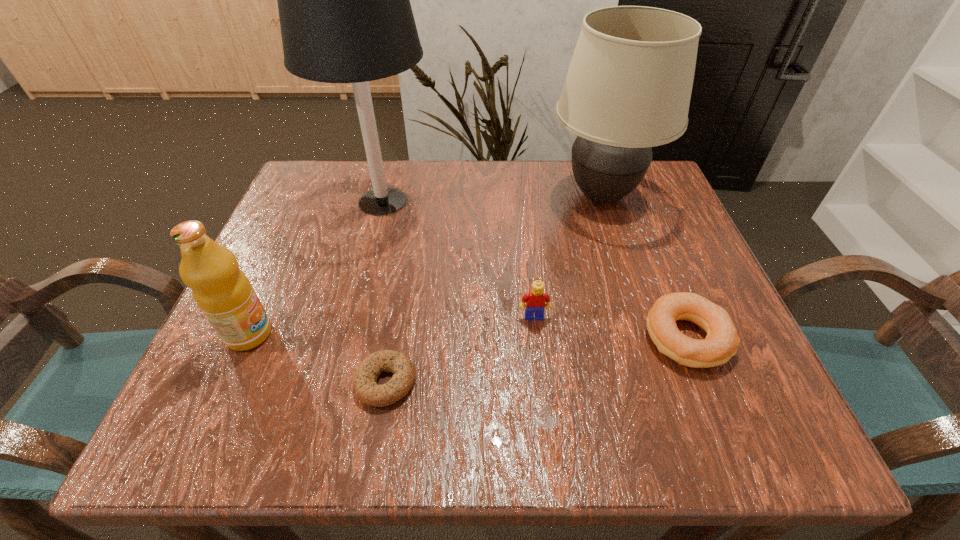
This screenshot has height=540, width=960. Find the location of `the tallest object`. the tallest object is located at coordinates [344, 6].

Where is `the second tallest object`? The height and width of the screenshot is (540, 960). the second tallest object is located at coordinates (628, 88).

The width and height of the screenshot is (960, 540). Identify the location of the fourth shortest object. (222, 291).

The image size is (960, 540). I want to click on fruit juice, so click(222, 291).

This screenshot has width=960, height=540. What are the coordinates of `Lego` in the screenshot? It's located at (535, 300).

You are a GUI agent. You are given a task and a screenshot of the screen. Output one action in this format:
    pyautogui.click(x=<x>, y=<y>)
    Task: Click on the third object from right to left
    Image resolution: width=960 pixels, height=540 pixels.
    Given the screenshot: What is the action you would take?
    pyautogui.click(x=535, y=300)

This screenshot has width=960, height=540. I want to click on the right bagel, so click(x=722, y=341).

Where is `the fifth tallest object`? Image resolution: width=960 pixels, height=540 pixels. the fifth tallest object is located at coordinates pos(722,341).

I want to click on the shorter bagel, so click(365, 385).

Identify the location of the shortest object. (365, 385).